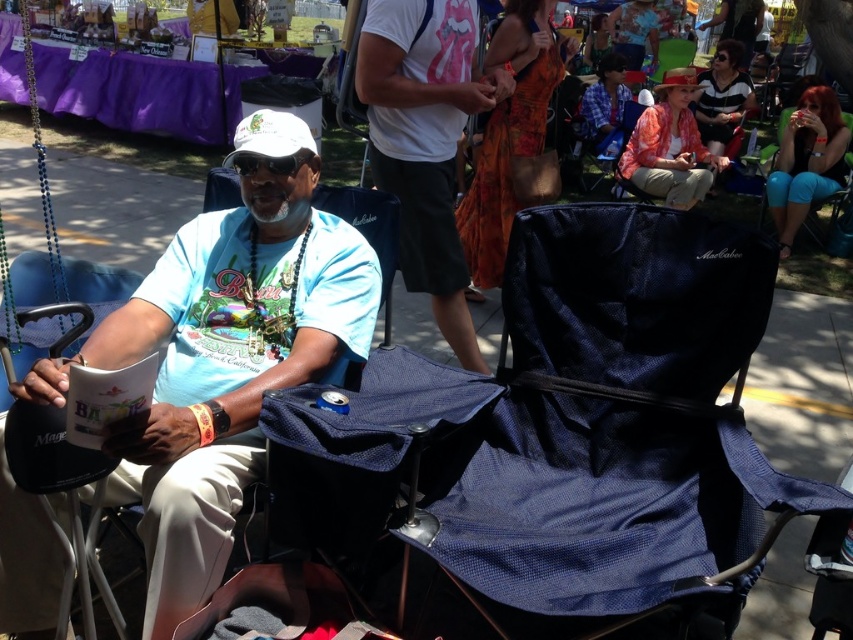
Question: Does teal denim shorts at right have a smaller size compared to striped fabric shirt at upper right?

Choices:
 (A) no
 (B) yes

Answer: (B)

Question: Can you confirm if matte blue t-shirt at center is thinner than orange floral dress at upper right?

Choices:
 (A) yes
 (B) no

Answer: (B)

Question: Which point appears farthest from the camera in this image?

Choices:
 (A) (637, 22)
 (B) (210, 378)
 (C) (628, 163)

Answer: (A)

Question: Can you confirm if white cotton t-shirt at center is positioned above orange floral dress at upper center?

Choices:
 (A) no
 (B) yes

Answer: (A)

Question: Which point is closer to the camera?

Choices:
 (A) orange floral dress at upper right
 (B) matte blue t-shirt at center
 (C) teal denim shorts at right

Answer: (B)

Question: Which object appears closest to the camera in this image?

Choices:
 (A) white cotton t-shirt at center
 (B) orange floral dress at upper right
 (C) striped fabric shirt at upper right

Answer: (A)